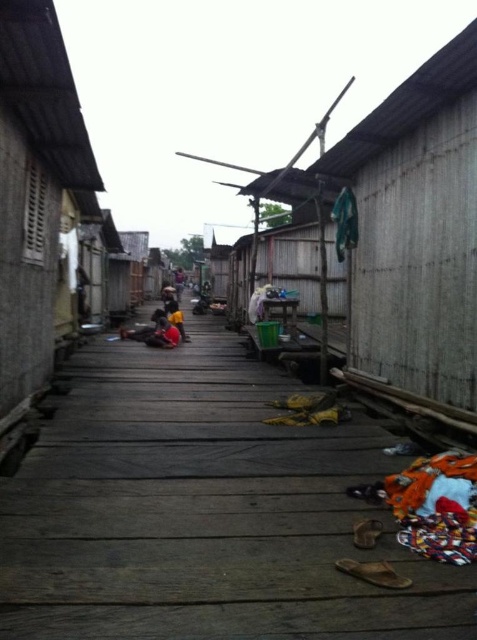
You are a delivery person trying to navigate a narrow wooden walkway. You see the wooden planks at center and the dark blue fabric at center. Which object is located to the right of the other?

The wooden planks at center is positioned on the right side of dark blue fabric at center, so the wooden planks at center is to the right of the dark blue fabric at center.

You are a delivery person trying to place a large box on the walkway between the dark brown leather jacket at center and the dark brown fabric at center. Can you fit the box if it is wider than both objects?

The dark brown leather jacket at center is wider than the dark brown fabric at center. Since the box is wider than both, it will not fit between them as the space between the two objects is narrower than the box.